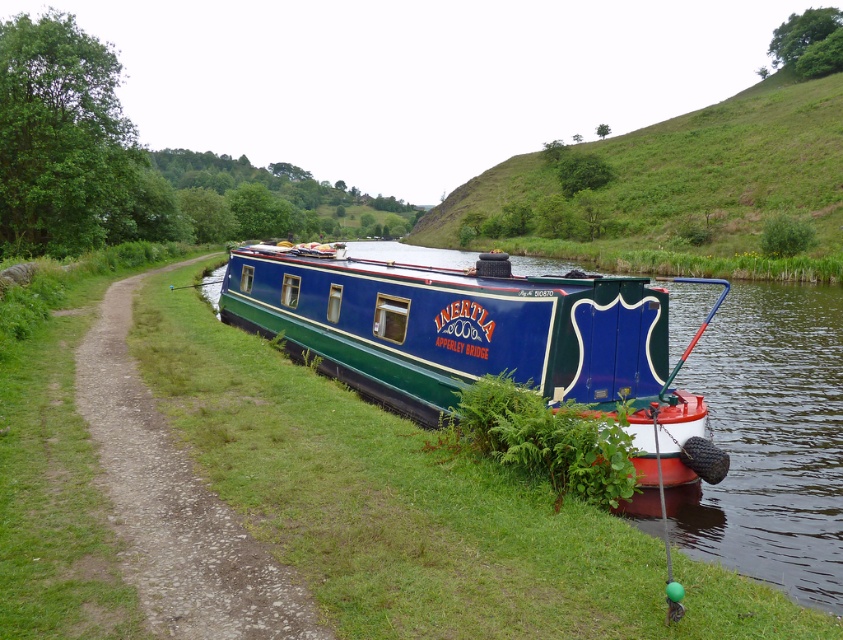
You are standing at the edge of the canal and want to place a small decorative rock exactly at the location marked by the green grass at lower center. According to the coordinates provided, what are the exact coordinates where you should place the rock?

The exact coordinates for placing the small decorative rock at the green grass at lower center are point (416,508).

You are standing on the deck of the narrowboat named Inertia, which is docked at the canal. You notice a point marked at coordinates [680,189]. What does this point indicate in the scene?

The point at coordinates [680,189] marks the green grassy hillside at upper center.